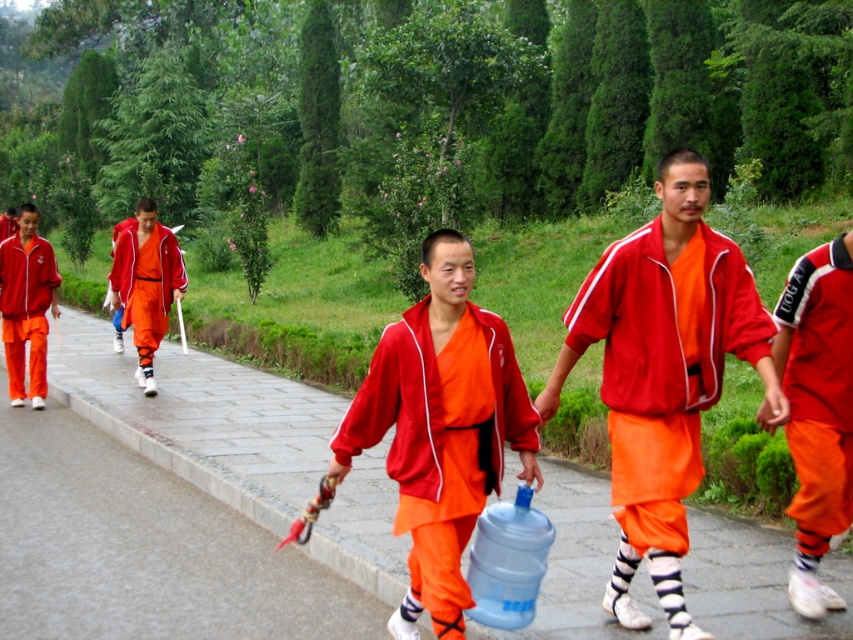
You are a photographer trying to capture the matte red tracksuit at left and the smooth concrete pavement at center in a single shot. Which object should you focus on first if you want to ensure both are in sharp focus?

The smooth concrete pavement at center is below the matte red tracksuit at left, so focusing on the matte red tracksuit at left first would ensure both are in sharp focus as the pavement is closer to the camera.

Based on the coordinates provided, what type of surface is located at point (x=202, y=419)?

The surface at point (x=202, y=419) is smooth concrete pavement.

You are a photographer positioned at the edge of the pathway. You want to take a photo of the matte red jacket at center and the smooth concrete pavement at center. Which object should you focus on first if you want to capture both in sharp focus?

The smooth concrete pavement at center is below matte red jacket at center, so you should focus on the matte red jacket at center first since it is closer to the camera.